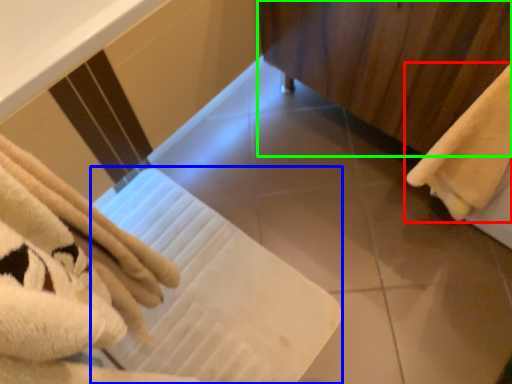
Question: Estimate the real-world distances between objects in this image. Which object is closer to towel (highlighted by a red box), bath towel (highlighted by a blue box) or curtain (highlighted by a green box)?

Choices:
 (A) bath towel
 (B) curtain

Answer: (B)